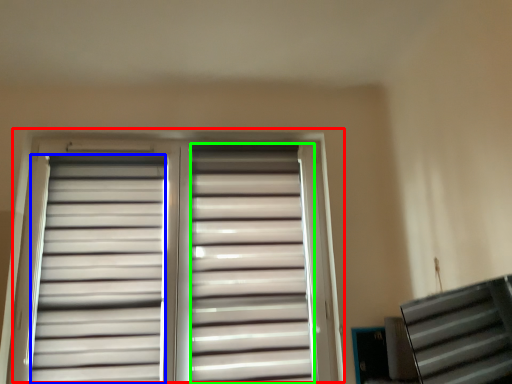
Question: Which object is positioned closest to window (highlighted by a red box)? Select from shutter (highlighted by a blue box) and shutter (highlighted by a green box).

Choices:
 (A) shutter
 (B) shutter

Answer: (A)